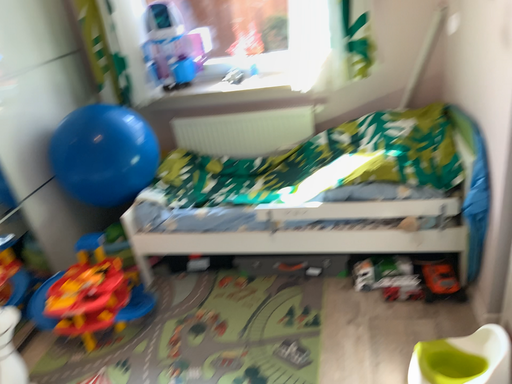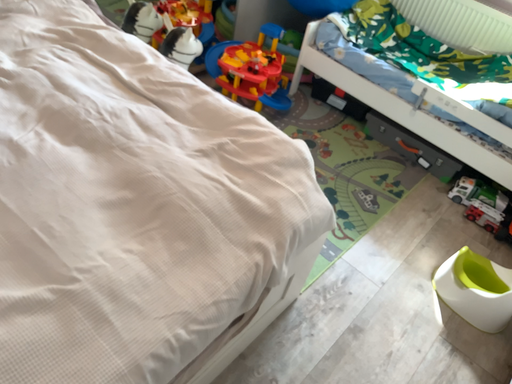
Question: How did the camera likely rotate when shooting the video?

Choices:
 (A) rotated downward
 (B) rotated upward

Answer: (A)